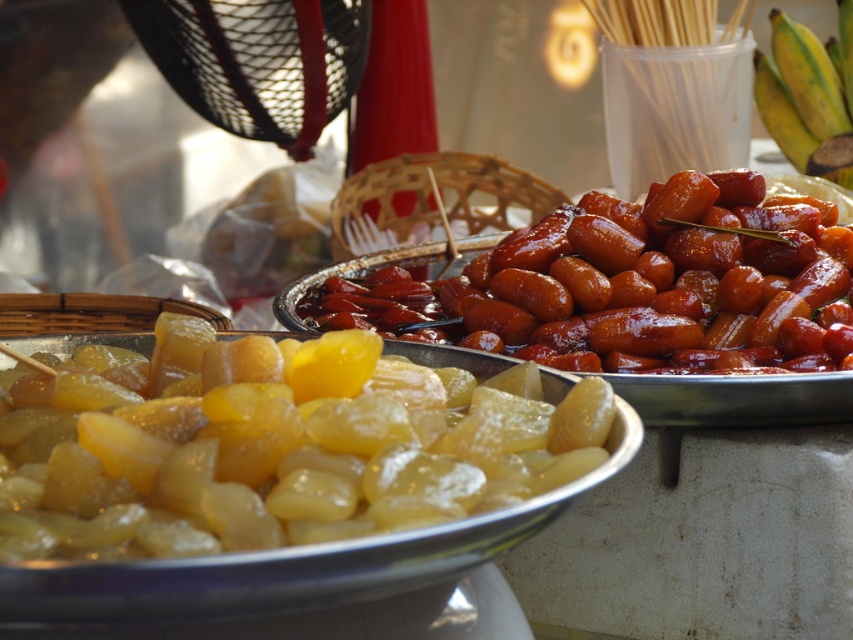
You are a customer at a food stall and see both the translucent yellow gummy at center and the shiny brown sausages at center. Which one is positioned lower in the image?

The translucent yellow gummy at center is located below the shiny brown sausages at center, so it is positioned lower in the image.

You are a food vendor at the market and want to arrange the translucent yellow gummy at center and the shiny brown sausages at center on a shelf. If you want to display them side by side, which one should you place on the left to make the arrangement look balanced?

Since the translucent yellow gummy at center is smaller in size compared to the shiny brown sausages at center, placing the smaller one on the left would create a balanced arrangement as it mirrors the size progression from left to right.

You are a customer at a food stall and see two items at the center of the trays. The items are the translucent yellow gummy at center and the shiny brown sausages at center. Which one is positioned more to the left?

The translucent yellow gummy at center is positioned more to the left than the shiny brown sausages at center.